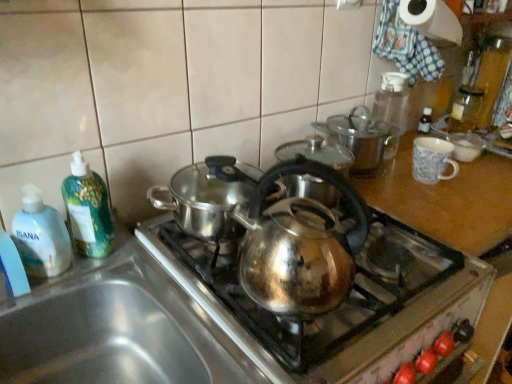
Question: From the image's perspective, is transparent plastic bottle at upper right, which ranks as the 2th bottle in right-to-left order, above or below green plastic bottle at left, which is the second bottle from front to back?

Choices:
 (A) above
 (B) below

Answer: (A)

Question: Is transparent plastic bottle at upper right, which ranks as the 2th bottle in right-to-left order, inside or outside of green plastic bottle at left, arranged as the second bottle when viewed from the left?

Choices:
 (A) outside
 (B) inside

Answer: (A)

Question: Which of these objects is positioned closest to the transparent plastic bottle at upper right, the third bottle positioned from the front?

Choices:
 (A) stainless steel sink at lower left
 (B) translucent plastic soap dispenser at left, which is the 1th bottle in front-to-back order
 (C) shiny metallic kettle at center
 (D) transparent glass bottle at upper right, which appears as the fourth bottle when viewed from the front
 (E) shiny metallic pot at upper center

Answer: (E)

Question: Which of these objects is positioned farthest from the green plastic bottle at left, arranged as the second bottle when viewed from the left?

Choices:
 (A) shiny metallic pot at upper center
 (B) white paper towel at upper right
 (C) transparent plastic bottle at upper right, which appears as the second bottle when viewed from the back
 (D) stainless steel sink at lower left
 (E) translucent plastic soap dispenser at left, the first bottle when ordered from left to right

Answer: (B)